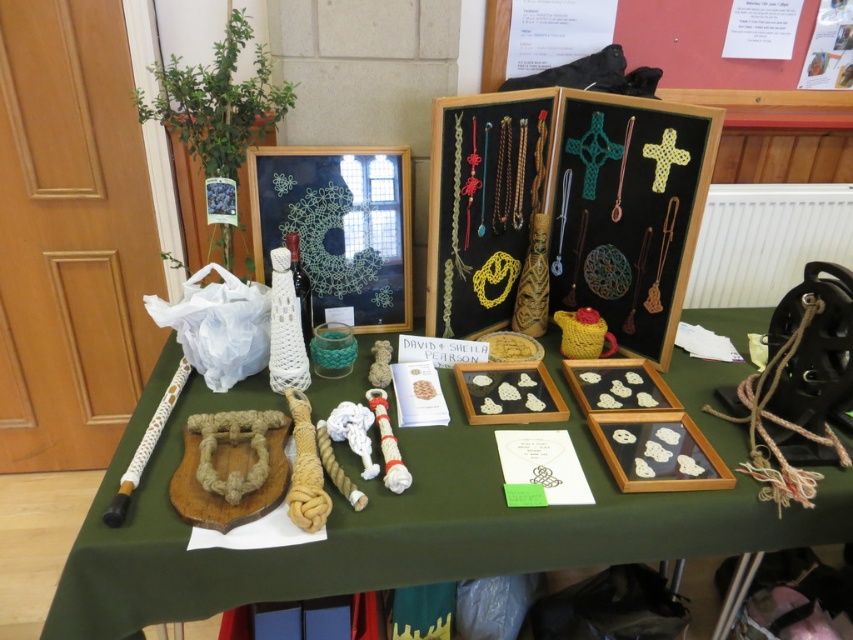
Is natural fiber rope at left below matte black frame at center?

Yes.

Between point (701, 413) and point (474, 218), which one is positioned behind?

The point (474, 218) is behind.

Identify the location of natural fiber rope at left. (399, 524).